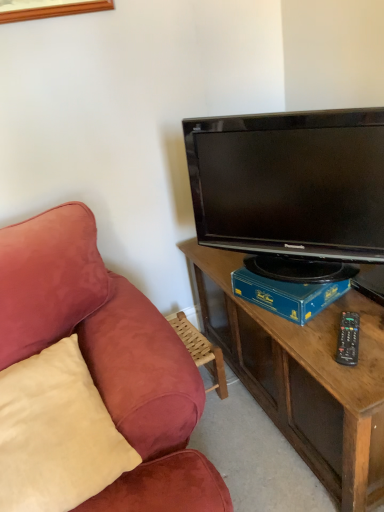
Image resolution: width=384 pixels, height=512 pixels. What do you see at coordinates (348, 339) in the screenshot? I see `black plastic remote control at right` at bounding box center [348, 339].

What is the approximate width of beige suede pillow at left?

beige suede pillow at left is 11.75 inches in width.

Identify the location of black glossy tv at upper right. (290, 183).

Find the location of a particular element. black plastic remote control at right is located at coordinates (348, 339).

Is black plastic remote control at right turned away from blue cardboard box at center?

Correct, black plastic remote control at right is looking away from blue cardboard box at center.

From the image's perspective, which one is positioned lower, black plastic remote control at right or blue cardboard box at center?

black plastic remote control at right, from the image's perspective.

Visually, is black plastic remote control at right positioned to the left or to the right of blue cardboard box at center?

From the image, it's evident that black plastic remote control at right is to the right of blue cardboard box at center.

I want to click on remote control that is below the blue cardboard box at center (from the image's perspective), so click(348, 339).

Image resolution: width=384 pixels, height=512 pixels. Identify the location of pillow located on the left of black plastic remote control at right. (56, 433).

From a real-world perspective, between beige suede pillow at left and black plastic remote control at right, who is vertically lower?

black plastic remote control at right is physically lower.

Is beige suede pillow at left bigger than black plastic remote control at right?

Correct, beige suede pillow at left is larger in size than black plastic remote control at right.

Consider the image. Is blue cardboard box at center to the left of black glossy tv at upper right from the viewer's perspective?

No.

What's the angular difference between blue cardboard box at center and black glossy tv at upper right's facing directions?

There is a 19.9-degree angle between the facing directions of blue cardboard box at center and black glossy tv at upper right.

From the picture: From a real-world perspective, is blue cardboard box at center positioned above or below black glossy tv at upper right?

blue cardboard box at center is situated lower than black glossy tv at upper right in the real world.

Is point (23, 377) less distant than point (318, 287)?

Yes, it is in front of point (318, 287).

Does beige suede pillow at left appear on the left side of blue cardboard box at center?

Correct, you'll find beige suede pillow at left to the left of blue cardboard box at center.

Between beige suede pillow at left and blue cardboard box at center, which one is positioned in front?

beige suede pillow at left is in front.

Is beige suede pillow at left far from blue cardboard box at center?

Actually, beige suede pillow at left and blue cardboard box at center are a little close together.

Is black plastic remote control at right surrounded by blue cardboard box at center?

Actually, black plastic remote control at right is outside blue cardboard box at center.

What are the coordinates of `remote control below the blue cardboard box at center (from the image's perspective)` in the screenshot? It's located at (348, 339).

Is point (325, 283) more distant than point (340, 362)?

Yes, point (325, 283) is farther from viewer.

Can you tell me how much black glossy tv at upper right and beige suede pillow at left differ in facing direction?

The facing directions of black glossy tv at upper right and beige suede pillow at left are 36.7 degrees apart.

Is black glossy tv at upper right shorter than beige suede pillow at left?

No.

Are black glossy tv at upper right and beige suede pillow at left beside each other?

black glossy tv at upper right and beige suede pillow at left are not in contact.

Which is more to the left, black glossy tv at upper right or beige suede pillow at left?

Positioned to the left is beige suede pillow at left.

Is point (383, 244) less distant than point (239, 291)?

Yes, it is.

From a real-world perspective, between black glossy tv at upper right and blue cardboard box at center, who is vertically lower?

From a 3D spatial view, blue cardboard box at center is below.

Considering the relative positions of black glossy tv at upper right and blue cardboard box at center in the image provided, is black glossy tv at upper right to the right of blue cardboard box at center from the viewer's perspective?

No.

Does black glossy tv at upper right touch blue cardboard box at center?

No, black glossy tv at upper right is not beside blue cardboard box at center.

Where is `book above the black plastic remote control at right (from the image's perspective)`? book above the black plastic remote control at right (from the image's perspective) is located at coordinates (287, 295).

Image resolution: width=384 pixels, height=512 pixels. Find the location of `pillow lying below the black plastic remote control at right (from the image's perspective)`. pillow lying below the black plastic remote control at right (from the image's perspective) is located at coordinates (56, 433).

Based on their spatial positions, is beige suede pillow at left or blue cardboard box at center further from black glossy tv at upper right?

beige suede pillow at left is positioned further to the anchor black glossy tv at upper right.

Based on their spatial positions, is beige suede pillow at left or black plastic remote control at right further from blue cardboard box at center?

beige suede pillow at left is positioned further to the anchor blue cardboard box at center.

In the scene shown: Looking at the image, which one is located further to blue cardboard box at center, black glossy tv at upper right or beige suede pillow at left?

beige suede pillow at left lies further to blue cardboard box at center than the other object.

Based on their spatial positions, is black plastic remote control at right or blue cardboard box at center further from beige suede pillow at left?

black plastic remote control at right is positioned further to the anchor beige suede pillow at left.

Based on their spatial positions, is beige suede pillow at left or blue cardboard box at center closer to black plastic remote control at right?

blue cardboard box at center.

When comparing their distances from blue cardboard box at center, does beige suede pillow at left or black glossy tv at upper right seem closer?

black glossy tv at upper right is positioned closer to the anchor blue cardboard box at center.

Consider the image. Looking at the image, which one is located closer to black plastic remote control at right, black glossy tv at upper right or blue cardboard box at center?

blue cardboard box at center is closer to black plastic remote control at right.

From the image, which object appears to be farther from black plastic remote control at right, blue cardboard box at center or beige suede pillow at left?

beige suede pillow at left is further to black plastic remote control at right.

Find the location of a particular element. Image resolution: width=384 pixels, height=512 pixels. book situated between beige suede pillow at left and black plastic remote control at right from left to right is located at coordinates (287, 295).

You are a GUI agent. You are given a task and a screenshot of the screen. Output one action in this format:
    pyautogui.click(x=<x>, y=<y>)
    Task: Click on the book between black glossy tv at upper right and black plastic remote control at right in the up-down direction
    
    Given the screenshot: What is the action you would take?
    pyautogui.click(x=287, y=295)

Where is `television located between beige suede pillow at left and blue cardboard box at center in the left-right direction`? This screenshot has width=384, height=512. television located between beige suede pillow at left and blue cardboard box at center in the left-right direction is located at coordinates (290, 183).

The image size is (384, 512). What are the coordinates of `television situated between beige suede pillow at left and black plastic remote control at right from left to right` in the screenshot? It's located at (290, 183).